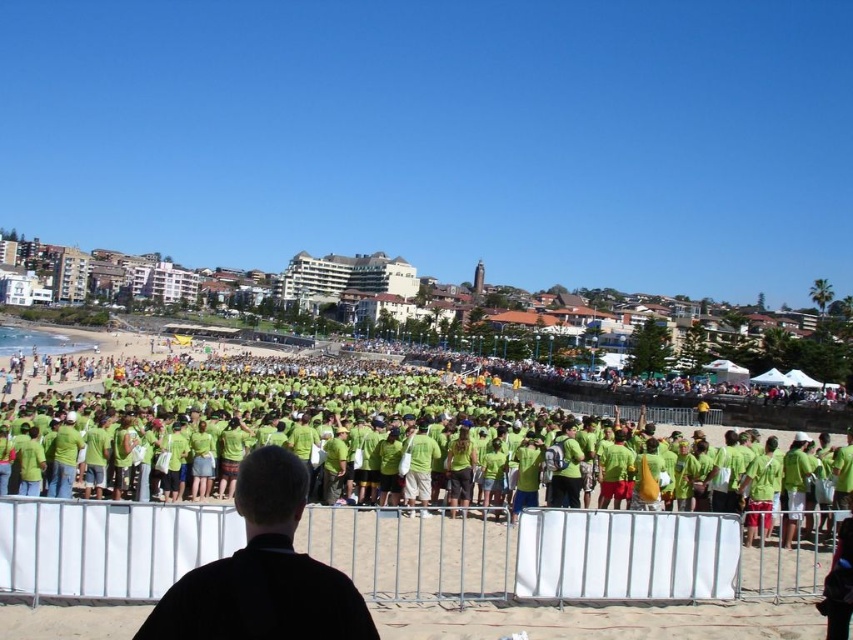
You are a photographer trying to capture a photo of the black matte jacket at center while ensuring the green fabric crowd at center is still visible in the background. Given their sizes, will you need to adjust your camera focus to make sure both are clear?

The green fabric crowd at center has a larger size compared to black matte jacket at center. Since the crowd is larger, it will naturally appear farther back, so you can keep the focus on the jacket while still having the crowd visible in the background without needing major adjustments.

You are a photographer trying to capture a clear shot of the black matte jacket at center without the green fabric crowd at center blocking it. Based on their positions, which direction should you move to get a better angle?

The green fabric crowd at center is to the right of the black matte jacket at center. To avoid the crowd blocking the jacket, move to the left side so that the jacket is positioned to the right of the crowd in your viewfinder.

You are a photographer standing at the edge of the beach, and you want to take a photo that includes both the green fabric crowd at center and the black matte jacket at center. Given that your camera has a maximum zoom range of 20 meters, will you be able to capture both subjects in the same frame without moving closer?

The distance between the green fabric crowd at center and the black matte jacket at center is 27.16 meters, which exceeds the camera maximum zoom range of 20 meters. Therefore, you will not be able to capture both subjects in the same frame without moving closer.